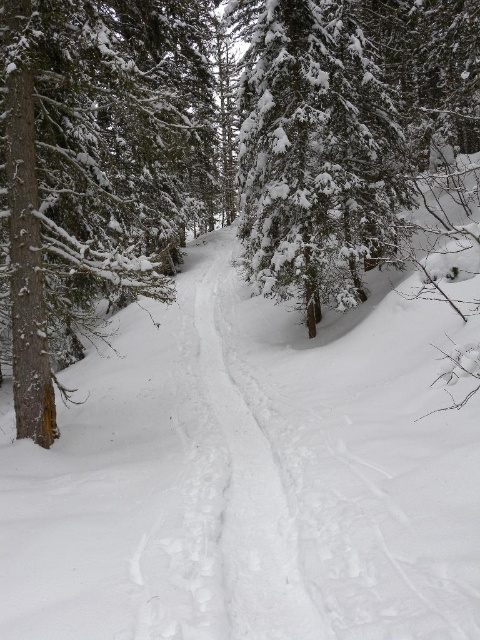
Is point (283, 176) farther from camera compared to point (167, 145)?

No, it is in front of (167, 145).

Is green textured pine tree at left to the right of brown wood tree at left from the viewer's perspective?

Correct, you'll find green textured pine tree at left to the right of brown wood tree at left.

I want to click on green textured pine tree at left, so click(98, 154).

The image size is (480, 640). I want to click on green textured pine tree at left, so click(x=98, y=154).

You are a GUI agent. You are given a task and a screenshot of the screen. Output one action in this format:
    pyautogui.click(x=<x>, y=<y>)
    Task: Click on the green textured pine tree at left
    The width and height of the screenshot is (480, 640).
    Given the screenshot: What is the action you would take?
    pyautogui.click(x=98, y=154)

Is point (335, 136) in front of point (232, 572)?

No, it is not.

The image size is (480, 640). What are the coordinates of `green textured pine tree at left` in the screenshot? It's located at tap(98, 154).

Can you confirm if brown wood tree at left is smaller than white snow trail at center?

No.

Which of these two, brown wood tree at left or white snow trail at center, stands shorter?

With less height is white snow trail at center.

Locate an element on the screen. The width and height of the screenshot is (480, 640). brown wood tree at left is located at coordinates (95, 170).